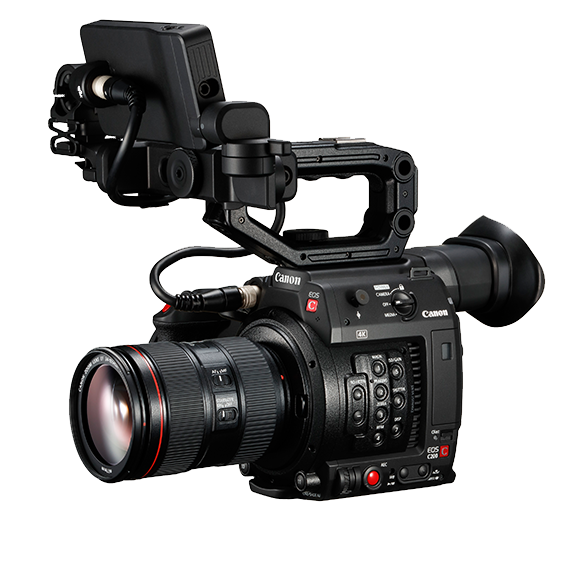
The height and width of the screenshot is (580, 580). What are the coordinates of `control knob` in the screenshot? It's located at (404, 302).